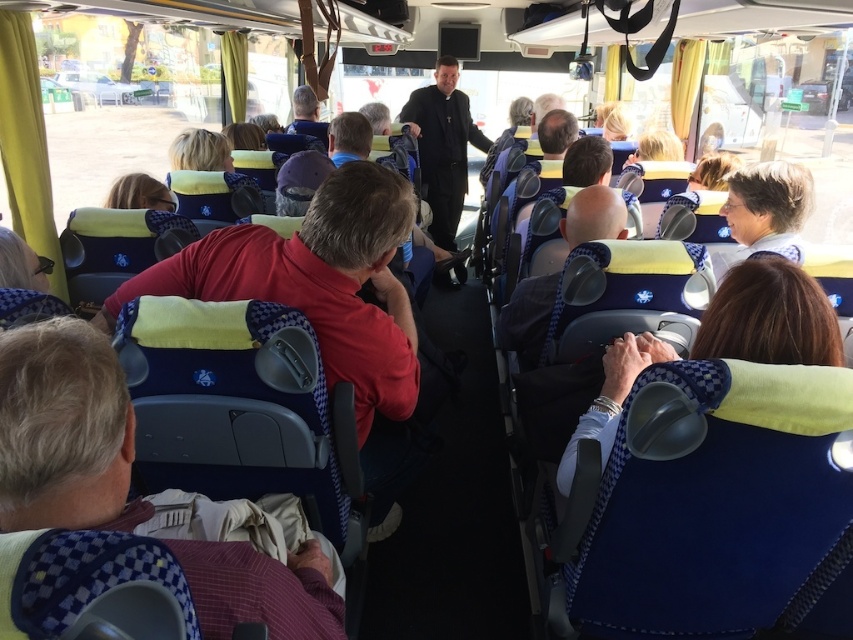
Does blue textured pillow at center appear on the left side of black matte coat at center?

No, blue textured pillow at center is not to the left of black matte coat at center.

Does blue textured pillow at center appear on the right side of black matte coat at center?

Correct, you'll find blue textured pillow at center to the right of black matte coat at center.

Which is in front, point (723, 307) or point (460, 112)?

Positioned in front is point (723, 307).

Locate an element on the screen. blue textured pillow at center is located at coordinates (769, 317).

Is point (51, 458) less distant than point (770, 340)?

Yes, it is in front of point (770, 340).

Can you confirm if maroon checkered shirt at lower left is bigger than blue textured pillow at center?

No, maroon checkered shirt at lower left is not bigger than blue textured pillow at center.

Between point (15, 420) and point (721, 332), which one is positioned in front?

Point (15, 420) is in front.

In order to click on maroon checkered shirt at lower left in this screenshot , I will do `click(64, 429)`.

The height and width of the screenshot is (640, 853). Describe the element at coordinates (444, 147) in the screenshot. I see `black matte coat at center` at that location.

Is black matte coat at center positioned before smooth blue shirt at center?

That is False.

Which is behind, point (444, 160) or point (554, 298)?

The point (444, 160) is behind.

Image resolution: width=853 pixels, height=640 pixels. I want to click on black matte coat at center, so click(x=444, y=147).